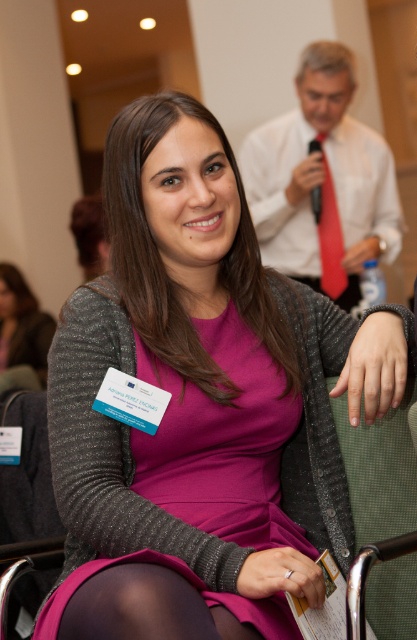
You are an event organizer who needs to ensure that all attendees can see the speaker clearly. You notice the matte gray cardigan at center and the silky red tie at center in the image. Which object is blocking the view to the speaker?

The silky red tie at center is behind the matte gray cardigan at center, so the matte gray cardigan at center is blocking the view to the speaker.